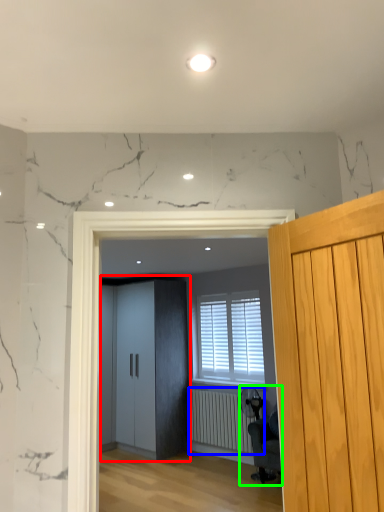
Question: Which is farther away from elevator (highlighted by a red box)? radiator (highlighted by a blue box) or swivel chair (highlighted by a green box)?

Choices:
 (A) radiator
 (B) swivel chair

Answer: (B)